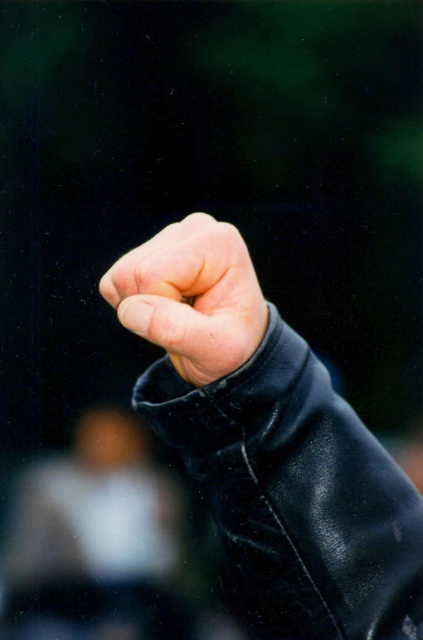
Is black leather jacket at center to the left of leather fist at center from the viewer's perspective?

Incorrect, black leather jacket at center is not on the left side of leather fist at center.

Does black leather jacket at center appear over leather fist at center?

Actually, black leather jacket at center is below leather fist at center.

Identify the location of black leather jacket at center. (296, 493).

Find the location of a particular element. black leather jacket at center is located at coordinates (296, 493).